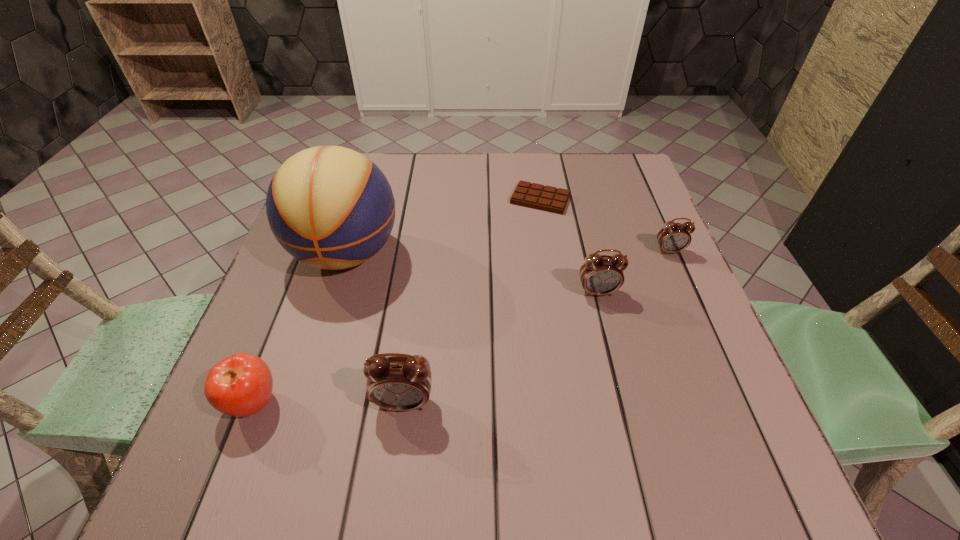
Where is `vacant space located 0.170m on the face of the second tallest alarm clock`? Image resolution: width=960 pixels, height=540 pixels. vacant space located 0.170m on the face of the second tallest alarm clock is located at coordinates (616, 367).

Locate an element on the screen. This screenshot has height=540, width=960. vacant space located 0.160m on the face of the rightmost alarm clock is located at coordinates (694, 308).

What are the coordinates of `vacant space positioned 0.130m on the left of the candy bar` in the screenshot? It's located at (462, 199).

Find the location of `vacant space located on the patterned surface of the tallest object`. vacant space located on the patterned surface of the tallest object is located at coordinates (316, 354).

Find the location of a particular element. This screenshot has height=540, width=960. vacant area located 0.060m on the back of the apple is located at coordinates (274, 350).

This screenshot has width=960, height=540. I want to click on object situated at the far edge, so click(x=537, y=196).

Locate an element on the screen. The image size is (960, 540). alarm clock that is at the near edge is located at coordinates (401, 383).

Where is `apple at the near edge`? The image size is (960, 540). apple at the near edge is located at coordinates (240, 385).

You are a GUI agent. You are given a task and a screenshot of the screen. Output one action in this format:
    pyautogui.click(x=<x>, y=<y>)
    Task: Click on the basketball positioned at the left edge
    The image size is (960, 540).
    Given the screenshot: What is the action you would take?
    click(330, 207)

At what (x,y) coordinates should I click in order to perform the action: click on apple at the left edge. Please return your answer as a coordinate pair (x, y). The height and width of the screenshot is (540, 960). Looking at the image, I should click on (240, 385).